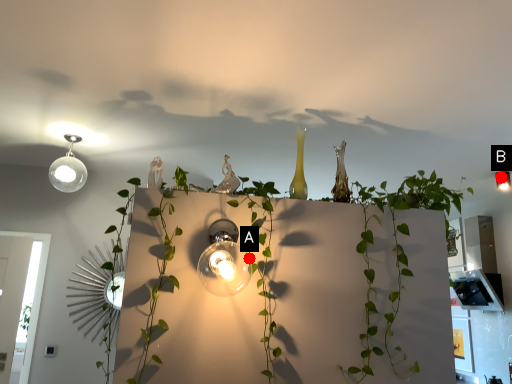
Question: Two points are circled on the image, labeled by A and B beside each circle. Which point is closer to the camera taking this photo?

Choices:
 (A) A is closer
 (B) B is closer

Answer: (A)